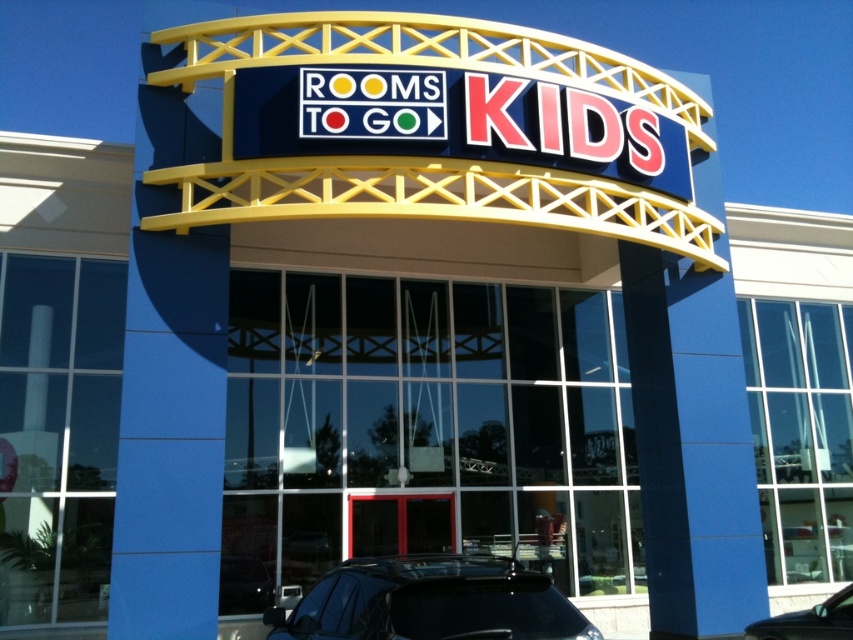
Question: Which object appears closest to the camera in this image?

Choices:
 (A) black matte car at lower center
 (B) shiny black car at lower right

Answer: (A)

Question: Considering the real-world distances, which object is farthest from the black matte car at lower center?

Choices:
 (A) shiny black car at lower right
 (B) metallic glass door at center

Answer: (B)

Question: Is black matte car at lower center smaller than shiny black car at lower right?

Choices:
 (A) yes
 (B) no

Answer: (B)

Question: Does black matte car at lower center have a greater width compared to metallic glass door at center?

Choices:
 (A) yes
 (B) no

Answer: (A)

Question: Where is metallic glass door at center located in relation to shiny black car at lower right in the image?

Choices:
 (A) above
 (B) below

Answer: (B)

Question: Which object is positioned closest to the shiny black car at lower right?

Choices:
 (A) black matte car at lower center
 (B) metallic glass door at center

Answer: (A)